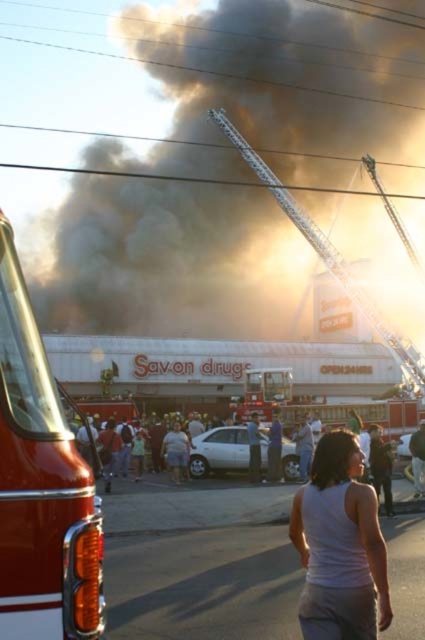
Question: Which point is closer to the camera taking this photo?

Choices:
 (A) click(255, 420)
 (B) click(371, 320)
 (C) click(413, 444)
 (D) click(309, 628)

Answer: (D)

Question: Can you confirm if smooth white tank top at center is positioned above white cotton shirt at center?

Choices:
 (A) yes
 (B) no

Answer: (A)

Question: Which object appears closest to the camera in this image?

Choices:
 (A) white cotton shirt at center
 (B) shiny red fire truck at left

Answer: (B)

Question: Can you confirm if white tank top at center is positioned to the left of smooth white tank top at center?

Choices:
 (A) yes
 (B) no

Answer: (A)

Question: Estimate the real-world distances between objects in this image. Which object is closer to the shiny red fire truck at left?

Choices:
 (A) white tank top at center
 (B) metallic silver fire truck at center
 (C) white cotton shirt at center
 (D) smooth white tank top at center

Answer: (A)

Question: From the image, what is the correct spatial relationship of shiny red fire truck at left in relation to white tank top at center?

Choices:
 (A) above
 (B) below

Answer: (A)